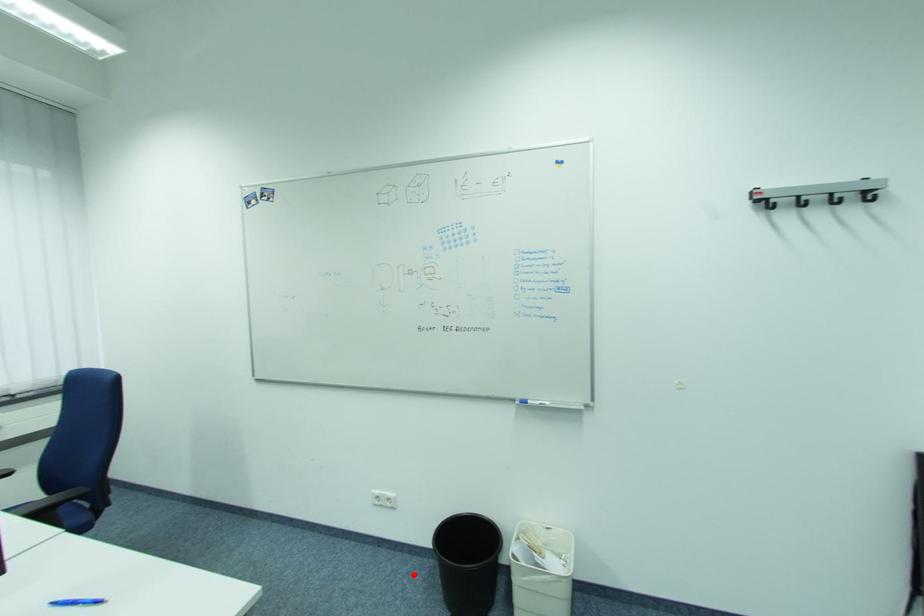
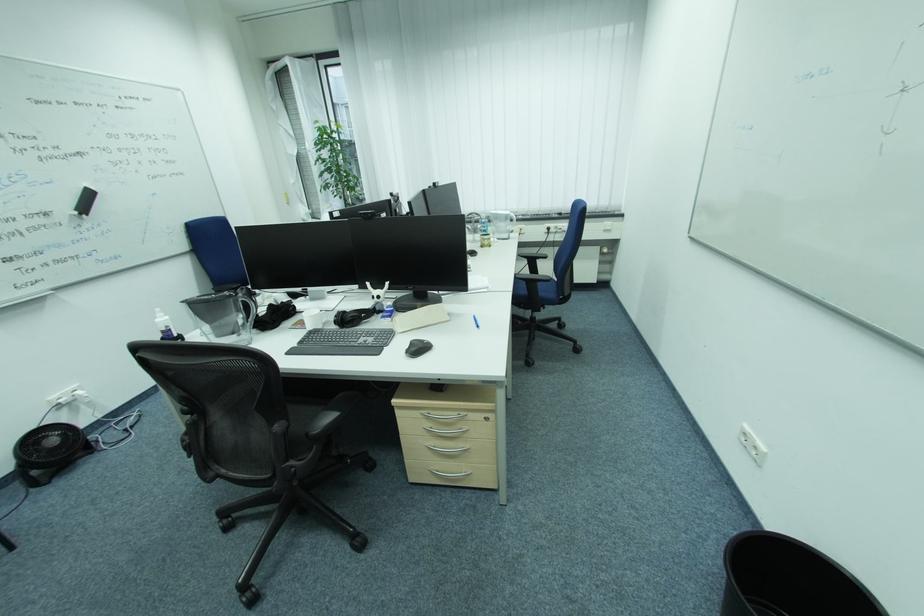
Where in the second image is the point corresponding to the highlighted location from the first image?

(733, 537)